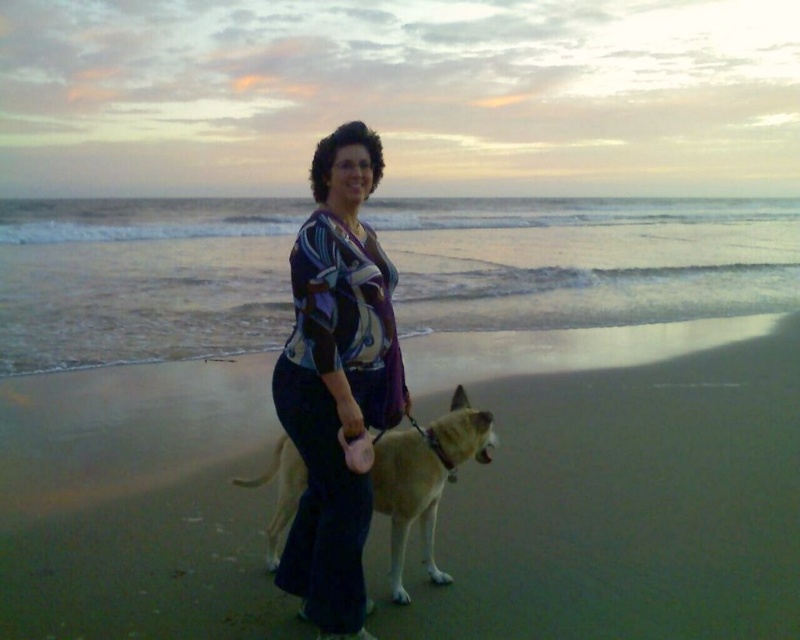
You are standing on the beach and see the sandy brown sand at center and the fuzzy tan dog at center. Which object is closer to you?

The sandy brown sand at center is closer to you because the fuzzy tan dog at center is behind it.

You are a photographer trying to capture the perfect shot of the printed silk blouse at center and the fuzzy tan dog at center. To ensure both are in the frame, should you adjust your camera to the left or right of the current position?

Since the printed silk blouse at center is to the left of the fuzzy tan dog at center, you should adjust your camera to the right to include both objects in the frame.

You are a photographer trying to capture the printed silk blouse at center in the scene. Where should you position your camera to ensure the blouse is centered in your shot?

To center the printed silk blouse at center in your shot, position your camera directly at the coordinates point (336, 380) where the blouse is located.